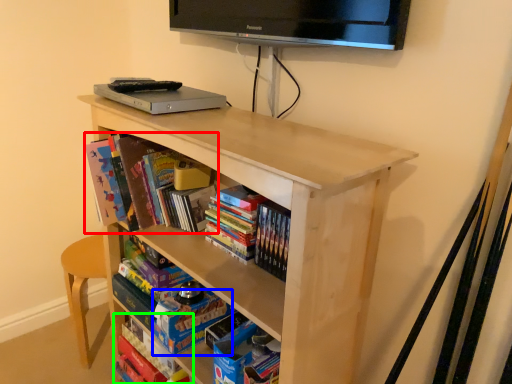
Question: Which is nearer to the book (highlighted by a red box)? paperback book (highlighted by a blue box) or book (highlighted by a green box).

Choices:
 (A) paperback book
 (B) book

Answer: (A)